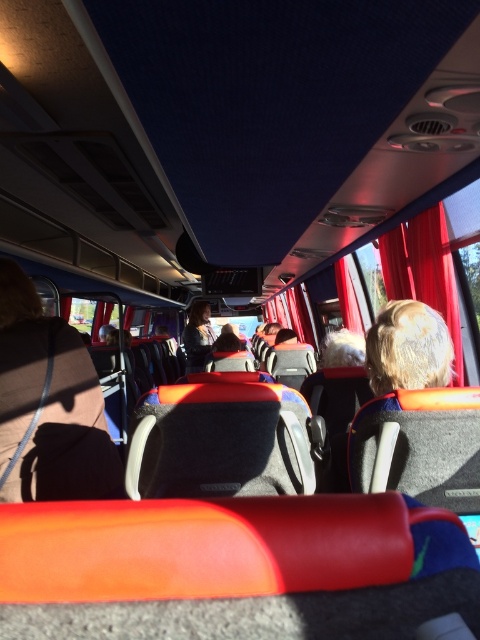
You are a bus driver who needs to check if a new luggage bag that is 1 meter tall can fit under the brown leather coach at lower left. Considering the height of the coach and the blonde hair at upper right, can the luggage be placed there?

The brown leather coach at lower left is much taller than the blonde hair at upper right. Since the luggage is 1 meter tall, and the coach is taller than the hair, it depends on the actual height of the coach. However, without specific measurements, it is impossible to determine if the luggage will fit.